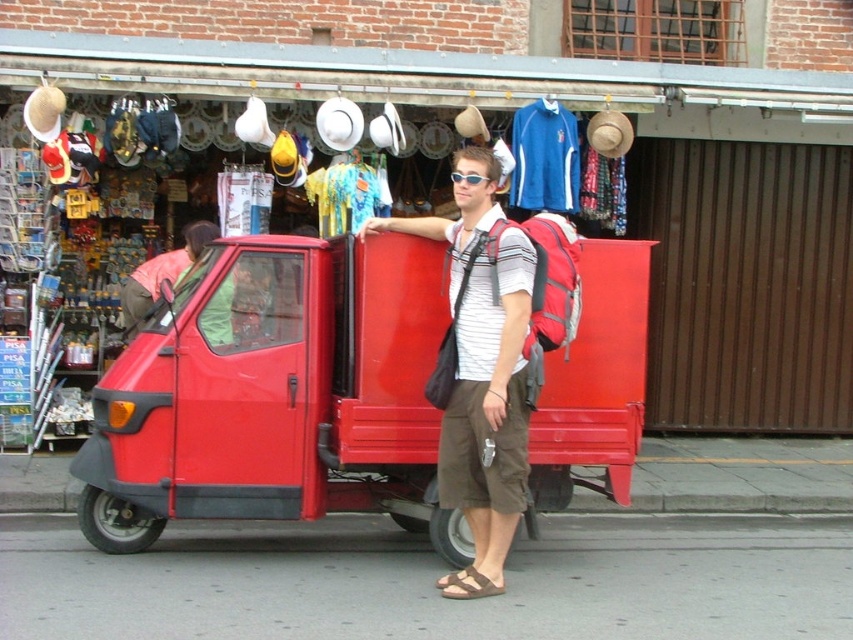
You are standing at point [461,596] and want to walk to point [619,486]. Is the path between these two points clear of any obstacles?

The path between point [619,486] and point [461,596] is clear of any obstacles because the man is leaning against the vehicle and the shop items are placed outside but not blocking the path.

You are standing at the point with coordinates [276,394]. Based on the scene, what object are you currently standing on?

The point with coordinates [276,394] is on the red matte metallic food truck at center.

You are a customer in a souvenir shop and see the matte green shirt at center and the sunglasses at center. The shopkeeper tells you that the items are placed at different distances from the entrance. If you want to grab both items quickly, which one should you reach for first?

The matte green shirt at center is 9.19 feet away from sunglasses at center. Since the matte green shirt at center is closer to the entrance than the sunglasses at center, you should reach for the matte green shirt at center first.